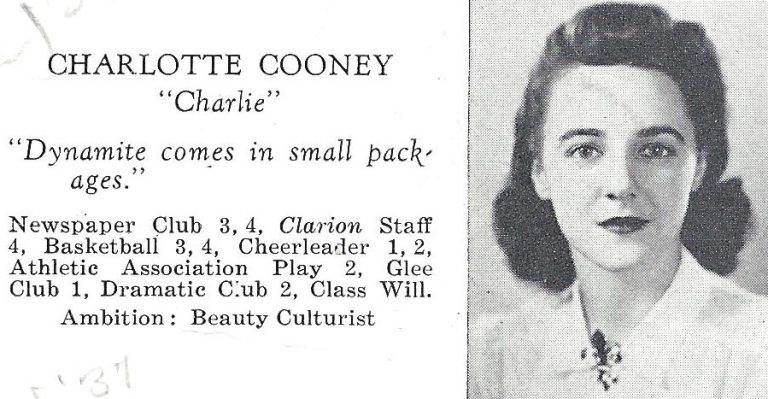
Where is `wall`? wall is located at coordinates (505, 33).